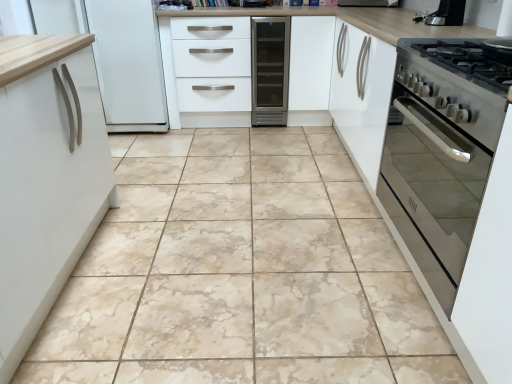
Describe the element at coordinates (212, 64) in the screenshot. I see `white matte drawer at center` at that location.

Where is `satin black coffee machine at upper right`? This screenshot has height=384, width=512. satin black coffee machine at upper right is located at coordinates (445, 14).

What do you see at coordinates (270, 70) in the screenshot?
I see `satin silver wine cooler at center` at bounding box center [270, 70].

At what (x,y) coordinates should I click in order to perform the action: click on satin silver wine cooler at center. Please return your answer as a coordinate pair (x, y). The image size is (512, 384). Looking at the image, I should click on (270, 70).

Describe the element at coordinates (240, 272) in the screenshot. The width and height of the screenshot is (512, 384). I see `marble tile at center` at that location.

At what (x,y) coordinates should I click in order to perform the action: click on stainless steel oven at right. Please return your answer as a coordinate pair (x, y). The width and height of the screenshot is (512, 384). Looking at the image, I should click on (441, 152).

Locate an element on the screen. This screenshot has width=512, height=384. white matte drawer at center is located at coordinates (212, 64).

Does marble tile at center have a smaller size compared to satin black coffee machine at upper right?

Incorrect, marble tile at center is not smaller in size than satin black coffee machine at upper right.

You are a GUI agent. You are given a task and a screenshot of the screen. Output one action in this format:
    pyautogui.click(x=<x>, y=<y>)
    Task: Click on the ceramic tile located on the left of satin black coffee machine at upper right
    
    Given the screenshot: What is the action you would take?
    pyautogui.click(x=240, y=272)

Considering the positions of point (486, 141) and point (199, 74), is point (486, 141) closer or farther from the camera than point (199, 74)?

Point (486, 141).

Is stainless steel oven at right oriented away from white matte drawer at center?

stainless steel oven at right does not have its back to white matte drawer at center.

From a real-world perspective, is stainless steel oven at right positioned under white matte drawer at center based on gravity?

Correct, in the physical world, stainless steel oven at right is lower than white matte drawer at center.

Is stainless steel oven at right far from white matte drawer at center?

Yes, stainless steel oven at right and white matte drawer at center are quite far apart.

Between point (429, 14) and point (262, 71), which one is positioned behind?

The point (262, 71) is farther.

From the image's perspective, is satin black coffee machine at upper right above satin silver wine cooler at center?

No, from the image's perspective, satin black coffee machine at upper right is not above satin silver wine cooler at center.

Is satin black coffee machine at upper right not close to satin silver wine cooler at center?

satin black coffee machine at upper right is far away from satin silver wine cooler at center.

Looking at this image, is satin black coffee machine at upper right next to stainless steel oven at right?

No.

Consider the image. Considering the sizes of objects satin black coffee machine at upper right and stainless steel oven at right in the image provided, who is smaller, satin black coffee machine at upper right or stainless steel oven at right?

With smaller size is satin black coffee machine at upper right.

From the image's perspective, is satin black coffee machine at upper right over stainless steel oven at right?

Indeed, from the image's perspective, satin black coffee machine at upper right is shown above stainless steel oven at right.

Does satin black coffee machine at upper right contain stainless steel oven at right?

No, stainless steel oven at right is located outside of satin black coffee machine at upper right.

Relative to satin silver wine cooler at center, is marble tile at center in front or behind?

marble tile at center is in front of satin silver wine cooler at center.

Is marble tile at center bigger than satin silver wine cooler at center?

Yes.

Does marble tile at center contain satin silver wine cooler at center?

That's incorrect, satin silver wine cooler at center is not inside marble tile at center.

From a real-world perspective, is stainless steel oven at right positioned over marble tile at center based on gravity?

Yes, from a real-world perspective, stainless steel oven at right is over marble tile at center

Would you say stainless steel oven at right is outside marble tile at center?

Yes, stainless steel oven at right is outside of marble tile at center.

Could you tell me if stainless steel oven at right is facing marble tile at center?

No, stainless steel oven at right is not aimed at marble tile at center.

Is stainless steel oven at right positioned far away from marble tile at center?

stainless steel oven at right is actually quite close to marble tile at center.

Is satin black coffee machine at upper right further to camera compared to white matte drawer at center?

That is False.

Is satin black coffee machine at upper right looking in the opposite direction of white matte drawer at center?

satin black coffee machine at upper right does not have its back to white matte drawer at center.

Considering the sizes of objects satin black coffee machine at upper right and white matte drawer at center in the image provided, who is thinner, satin black coffee machine at upper right or white matte drawer at center?

satin black coffee machine at upper right is thinner.

At what (x,y) coordinates should I click in order to perform the action: click on appliance above the marble tile at center (from the image's perspective). Please return your answer as a coordinate pair (x, y). This screenshot has height=384, width=512. Looking at the image, I should click on (445, 14).

Image resolution: width=512 pixels, height=384 pixels. Find the location of `oven below the white matte drawer at center (from a real-world perspective)`. oven below the white matte drawer at center (from a real-world perspective) is located at coordinates (441, 152).

From the picture: Estimate the real-world distances between objects in this image. Which object is further from satin silver wine cooler at center, stainless steel oven at right or white matte drawer at center?

stainless steel oven at right lies further to satin silver wine cooler at center than the other object.

Estimate the real-world distances between objects in this image. Which object is closer to satin silver wine cooler at center, marble tile at center or satin black coffee machine at upper right?

Based on the image, satin black coffee machine at upper right appears to be nearer to satin silver wine cooler at center.

Estimate the real-world distances between objects in this image. Which object is further from white matte drawer at center, satin silver wine cooler at center or satin black coffee machine at upper right?

Among the two, satin black coffee machine at upper right is located further to white matte drawer at center.

Looking at the image, which one is located further to satin silver wine cooler at center, white matte drawer at center or satin black coffee machine at upper right?

satin black coffee machine at upper right is positioned further to the anchor satin silver wine cooler at center.

Based on their spatial positions, is marble tile at center or satin silver wine cooler at center further from satin black coffee machine at upper right?

marble tile at center lies further to satin black coffee machine at upper right than the other object.

Which object lies further to the anchor point satin silver wine cooler at center, marble tile at center or white matte drawer at center?

The object further to satin silver wine cooler at center is marble tile at center.

Consider the image. Considering their positions, is stainless steel oven at right positioned further to white matte drawer at center than marble tile at center?

stainless steel oven at right is further to white matte drawer at center.

Based on their spatial positions, is white matte drawer at center or satin black coffee machine at upper right further from marble tile at center?

Based on the image, satin black coffee machine at upper right appears to be further to marble tile at center.

At what (x,y) coordinates should I click in order to perform the action: click on appliance located between marble tile at center and white matte drawer at center in the depth direction. Please return your answer as a coordinate pair (x, y). Looking at the image, I should click on (445, 14).

At what (x,y) coordinates should I click in order to perform the action: click on appliance between marble tile at center and satin silver wine cooler at center in the front-back direction. Please return your answer as a coordinate pair (x, y). The height and width of the screenshot is (384, 512). Looking at the image, I should click on coord(445,14).

Find the location of a particular element. drawer between marble tile at center and satin silver wine cooler at center along the z-axis is located at coordinates (212, 64).

I want to click on home appliance between white matte drawer at center and satin black coffee machine at upper right, so click(270, 70).